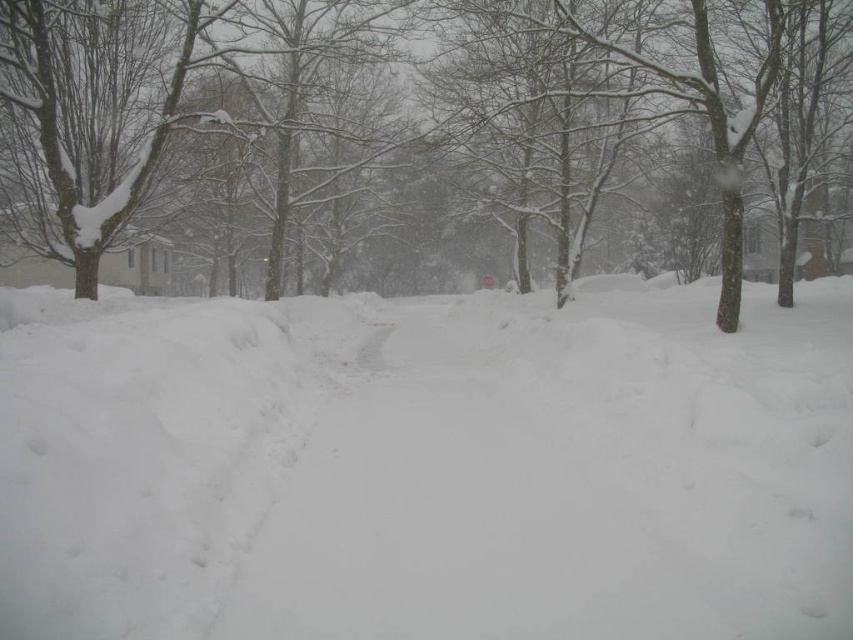
Does white fluffy snow at center lie in front of snow-covered bark tree at left?

Yes, white fluffy snow at center is in front of snow-covered bark tree at left.

Is white fluffy snow at center bigger than snow-covered bark tree at left?

Yes, white fluffy snow at center is bigger than snow-covered bark tree at left.

The height and width of the screenshot is (640, 853). I want to click on white fluffy snow at center, so click(x=426, y=467).

At what (x,y) coordinates should I click in order to perform the action: click on white fluffy snow at center. Please return your answer as a coordinate pair (x, y). Looking at the image, I should click on (426, 467).

Between white fluffy snow at center and snow-covered tree at center, which one appears on the left side from the viewer's perspective?

snow-covered tree at center

This screenshot has height=640, width=853. What do you see at coordinates (426, 467) in the screenshot?
I see `white fluffy snow at center` at bounding box center [426, 467].

Is point (355, 474) positioned behind point (86, 296)?

No, (355, 474) is in front of (86, 296).

Locate an element on the screen. The height and width of the screenshot is (640, 853). white fluffy snow at center is located at coordinates (426, 467).

Does point (463, 12) come farther from viewer compared to point (38, 116)?

Yes, point (463, 12) is behind point (38, 116).

Is snow-covered tree at center bigger than snow-covered bark tree at left?

Correct, snow-covered tree at center is larger in size than snow-covered bark tree at left.

Which is behind, point (76, 45) or point (76, 282)?

Point (76, 45)

Locate an element on the screen. snow-covered tree at center is located at coordinates (422, 124).